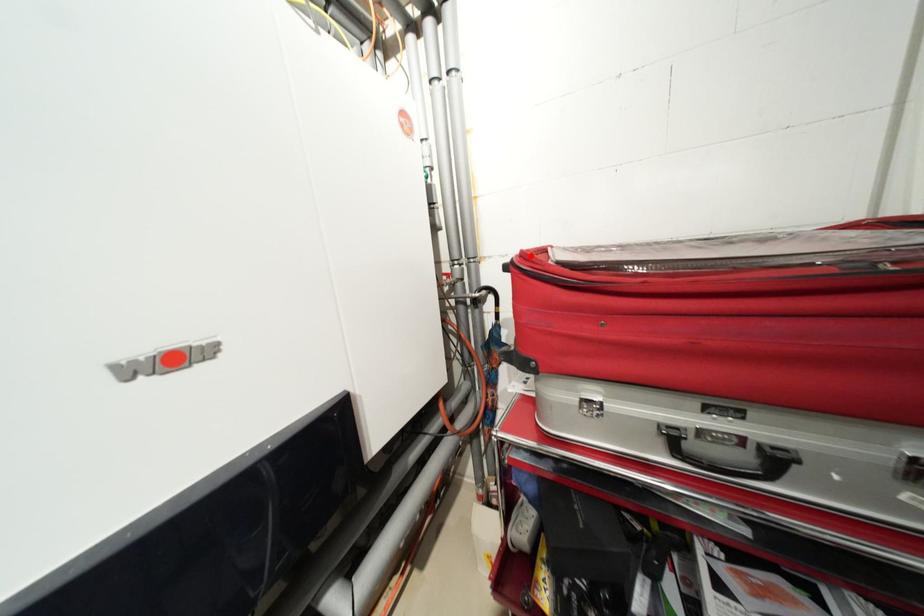
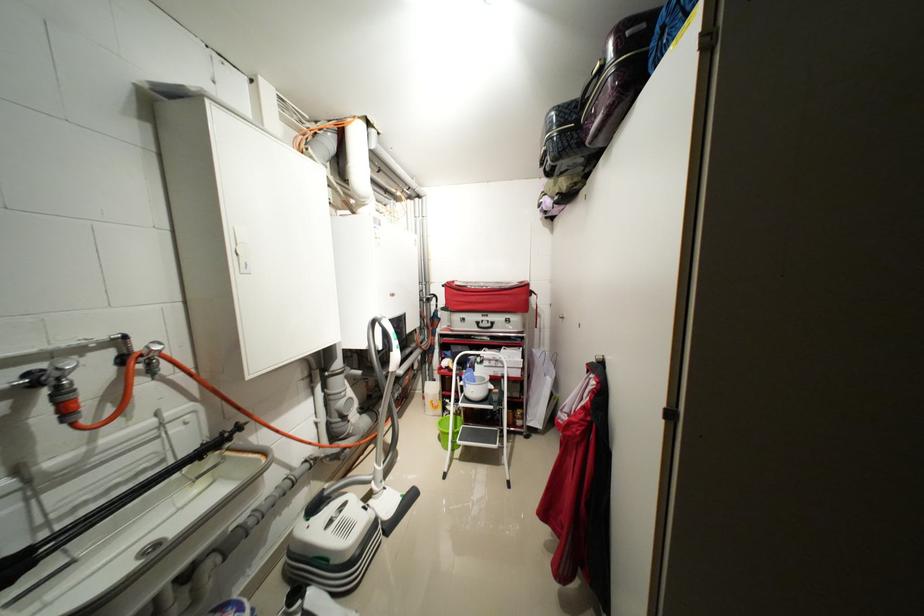
Find the pixel in the second image that matches the highlighted location in the first image.

(455, 284)